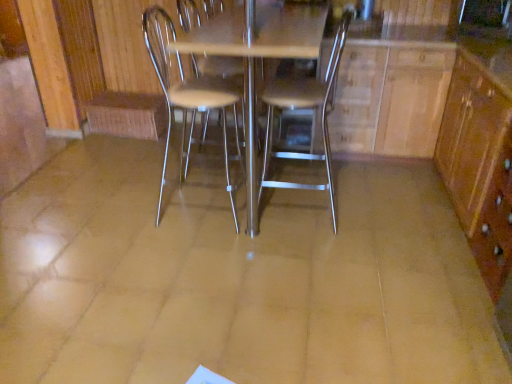
The height and width of the screenshot is (384, 512). Find the location of `metallic silver table at center`. metallic silver table at center is located at coordinates (255, 59).

This screenshot has width=512, height=384. What do you see at coordinates (440, 125) in the screenshot?
I see `wooden dresser at center` at bounding box center [440, 125].

Measure the distance between point (484, 215) and camera.

The distance of point (484, 215) from camera is 1.99 meters.

Where is `metallic silver table at center`? Image resolution: width=512 pixels, height=384 pixels. metallic silver table at center is located at coordinates (255, 59).

Is metallic silver chair at center, the second chair viewed from the right, facing away from metallic silver table at center?

Correct, metallic silver chair at center, the second chair viewed from the right, is looking away from metallic silver table at center.

Is metallic silver chair at center, the first chair when ordered from left to right, smaller than metallic silver table at center?

Yes, metallic silver chair at center, the first chair when ordered from left to right, is smaller than metallic silver table at center.

Is point (214, 86) positioned after point (251, 105)?

That is True.

How different are the orientations of metallic silver chair at center, the first chair when ordered from left to right, and metallic silver table at center in degrees?

metallic silver chair at center, the first chair when ordered from left to right, and metallic silver table at center are facing 92.4 degrees away from each other.

Does brown wood/file cabinet at right have a lesser width compared to metallic silver table at center?

Indeed, brown wood/file cabinet at right has a lesser width compared to metallic silver table at center.

Does brown wood/file cabinet at right contain metallic silver table at center?

No, metallic silver table at center is not inside brown wood/file cabinet at right.

Consider the image. Which of these two, brown wood/file cabinet at right or metallic silver table at center, stands shorter?

brown wood/file cabinet at right is shorter.

Is metallic silver chair at center, the second chair viewed from the right, touching brown wood/file cabinet at right?

metallic silver chair at center, the second chair viewed from the right, and brown wood/file cabinet at right are not in contact.

Which is behind, point (222, 117) or point (494, 136)?

Positioned behind is point (222, 117).

Considering the relative sizes of metallic silver chair at center, the first chair when ordered from left to right, and brown wood/file cabinet at right in the image provided, is metallic silver chair at center, the first chair when ordered from left to right, smaller than brown wood/file cabinet at right?

Yes.

What's the angular difference between brown wood/file cabinet at right and wooden dresser at center's facing directions?

The facing directions of brown wood/file cabinet at right and wooden dresser at center are 0.696 degrees apart.

Can you confirm if brown wood/file cabinet at right is bigger than wooden dresser at center?

Incorrect, brown wood/file cabinet at right is not larger than wooden dresser at center.

Between brown wood/file cabinet at right and wooden dresser at center, which one appears on the left side from the viewer's perspective?

wooden dresser at center.

You are a GUI agent. You are given a task and a screenshot of the screen. Output one action in this format:
    pyautogui.click(x=<x>, y=<y>)
    Task: Click on the file cabinet lying on the right of wooden dresser at center
    
    Given the screenshot: What is the action you would take?
    pyautogui.click(x=479, y=163)

Which is more to the left, metallic silver table at center or metallic silver chair at center, placed as the second chair when sorted from left to right?

metallic silver table at center.

Is metallic silver table at center facing towards metallic silver chair at center, the 1th chair viewed from the right?

Yes, metallic silver table at center is facing metallic silver chair at center, the 1th chair viewed from the right.

Considering the positions of points (314, 15) and (267, 169), is point (314, 15) closer to camera compared to point (267, 169)?

Yes, it is in front of point (267, 169).

Relative to metallic silver chair at center, placed as the second chair when sorted from left to right, is metallic silver table at center in front or behind?

Visually, metallic silver table at center is located in front of metallic silver chair at center, placed as the second chair when sorted from left to right.

Measure the distance between wooden dresser at center and metallic silver chair at center, the 1th chair viewed from the right.

wooden dresser at center and metallic silver chair at center, the 1th chair viewed from the right, are 17.23 inches apart from each other.

Is wooden dresser at center wider than metallic silver chair at center, placed as the second chair when sorted from left to right?

Indeed, wooden dresser at center has a greater width compared to metallic silver chair at center, placed as the second chair when sorted from left to right.

Considering the positions of point (444, 68) and point (344, 45), is point (444, 68) closer or farther from the camera than point (344, 45)?

Point (444, 68) is closer to the camera than point (344, 45).

Is wooden dresser at center taller than metallic silver chair at center, the 1th chair viewed from the right?

Incorrect, the height of wooden dresser at center is not larger of that of metallic silver chair at center, the 1th chair viewed from the right.

Which object is positioned more to the right, metallic silver chair at center, placed as the second chair when sorted from left to right, or wooden dresser at center?

Positioned to the right is wooden dresser at center.

Is point (273, 184) positioned after point (469, 232)?

Yes.

Is wooden dresser at center located within metallic silver chair at center, the 1th chair viewed from the right?

No, wooden dresser at center is located outside of metallic silver chair at center, the 1th chair viewed from the right.

From a real-world perspective, count 1st chairs upward from the metallic silver table at center and point to it. Please provide its 2D coordinates.

[(190, 97)]

This screenshot has height=384, width=512. I want to click on file cabinet on the right of metallic silver table at center, so click(x=479, y=163).

Looking at the image, which one is located closer to wooden dresser at center, metallic silver chair at center, the first chair when ordered from left to right, or metallic silver chair at center, placed as the second chair when sorted from left to right?

metallic silver chair at center, placed as the second chair when sorted from left to right, is closer to wooden dresser at center.

Estimate the real-world distances between objects in this image. Which object is further from metallic silver table at center, brown wood/file cabinet at right or metallic silver chair at center, placed as the second chair when sorted from left to right?

Among the two, brown wood/file cabinet at right is located further to metallic silver table at center.

When comparing their distances from brown wood/file cabinet at right, does metallic silver chair at center, the 1th chair viewed from the right, or metallic silver chair at center, the second chair viewed from the right, seem further?

metallic silver chair at center, the second chair viewed from the right, lies further to brown wood/file cabinet at right than the other object.

Looking at this image, when comparing their distances from brown wood/file cabinet at right, does metallic silver chair at center, the second chair viewed from the right, or wooden dresser at center seem further?

metallic silver chair at center, the second chair viewed from the right.

Looking at the image, which one is located further to metallic silver chair at center, placed as the second chair when sorted from left to right, metallic silver chair at center, the first chair when ordered from left to right, or metallic silver table at center?

Based on the image, metallic silver table at center appears to be further to metallic silver chair at center, placed as the second chair when sorted from left to right.

Looking at the image, which one is located further to brown wood/file cabinet at right, metallic silver table at center or metallic silver chair at center, placed as the second chair when sorted from left to right?

metallic silver table at center.

When comparing their distances from metallic silver chair at center, the first chair when ordered from left to right, does metallic silver table at center or wooden dresser at center seem closer?

The object closer to metallic silver chair at center, the first chair when ordered from left to right, is metallic silver table at center.

Estimate the real-world distances between objects in this image. Which object is further from wooden dresser at center, metallic silver table at center or brown wood/file cabinet at right?

Among the two, metallic silver table at center is located further to wooden dresser at center.

At what (x,y) coordinates should I click in order to perform the action: click on chair situated between metallic silver table at center and brown wood/file cabinet at right from left to right. Please return your answer as a coordinate pair (x, y). The height and width of the screenshot is (384, 512). Looking at the image, I should click on (305, 108).

Image resolution: width=512 pixels, height=384 pixels. What are the coordinates of `table between metallic silver chair at center, the second chair viewed from the right, and wooden dresser at center` in the screenshot? It's located at (255, 59).

Find the location of `chair between metallic silver chair at center, the first chair when ordered from left to right, and brown wood/file cabinet at right`. chair between metallic silver chair at center, the first chair when ordered from left to right, and brown wood/file cabinet at right is located at coordinates (305, 108).

This screenshot has height=384, width=512. What are the coordinates of `table between metallic silver chair at center, the second chair viewed from the right, and brown wood/file cabinet at right from left to right` in the screenshot? It's located at (255, 59).